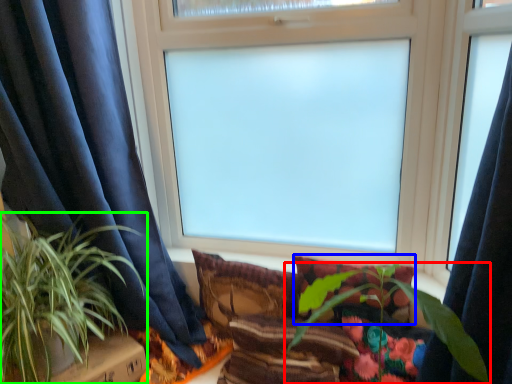
Question: Which object is the farthest from houseplant (highlighted by a red box)? Choose among these: pillow (highlighted by a blue box) or houseplant (highlighted by a green box).

Choices:
 (A) pillow
 (B) houseplant

Answer: (B)